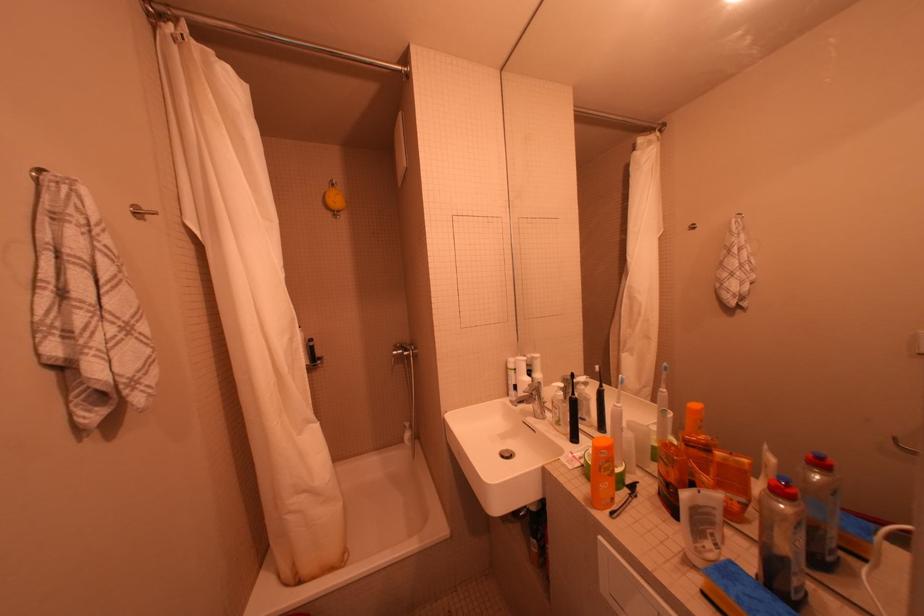
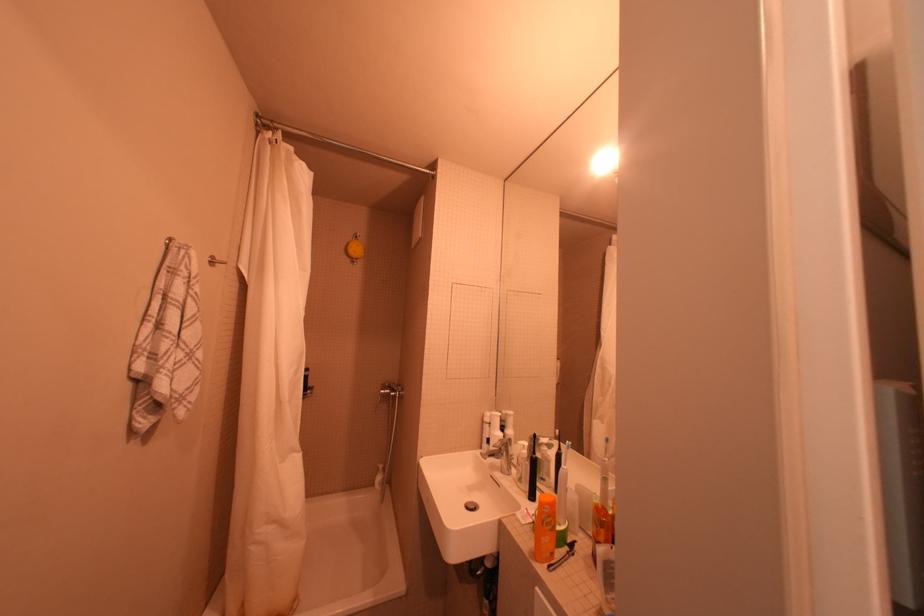
Find the pixel in the second image that matches (591,505) in the first image.

(536, 557)